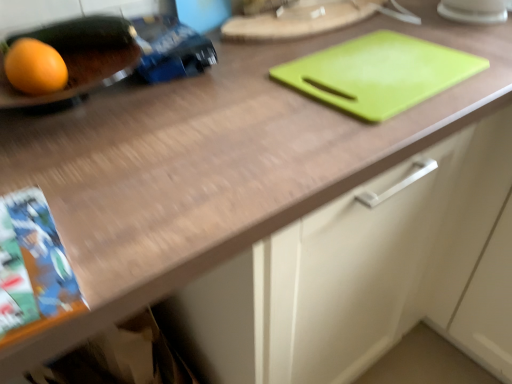
The height and width of the screenshot is (384, 512). Identify the location of free point in front of orange matte grapefruit at left. (50, 142).